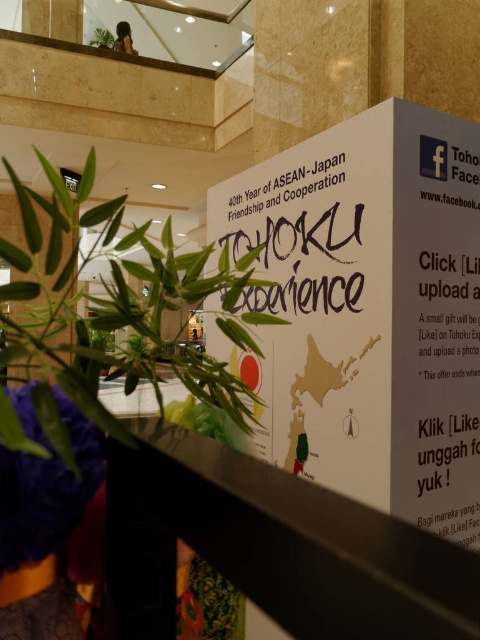
You are holding a camera and want to take a photo of the white paper sign at center. If you are standing 4.31 feet away from the sign, is the distance sufficient to capture the entire sign in one frame?

The distance between you and the white paper sign at center is exactly 4.31 feet, which is the minimum required to capture the entire sign in one frame.

You are standing in front of the promotional display for the 40th Year of ASEAN Japan Friendship and Cooperation. There is a point at coordinates (x=367, y=310). What object is located at this point?

The white paper sign at center is located at point (x=367, y=310).

You are standing in the mall and see the white paper sign at center and the green leafy plant at lower left. Which object takes up more space in the image?

The green leafy plant at lower left takes up more space in the image because it is larger than the white paper sign at center.